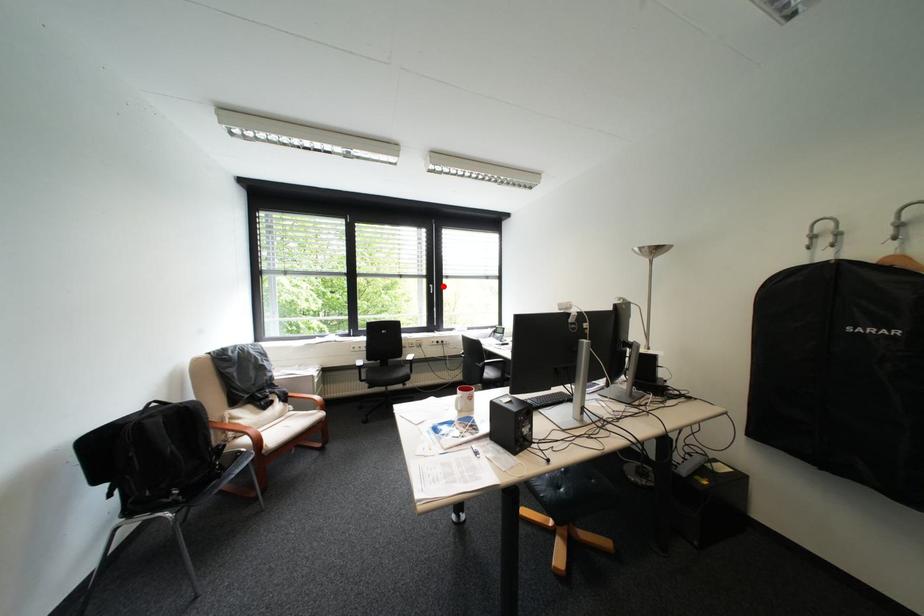
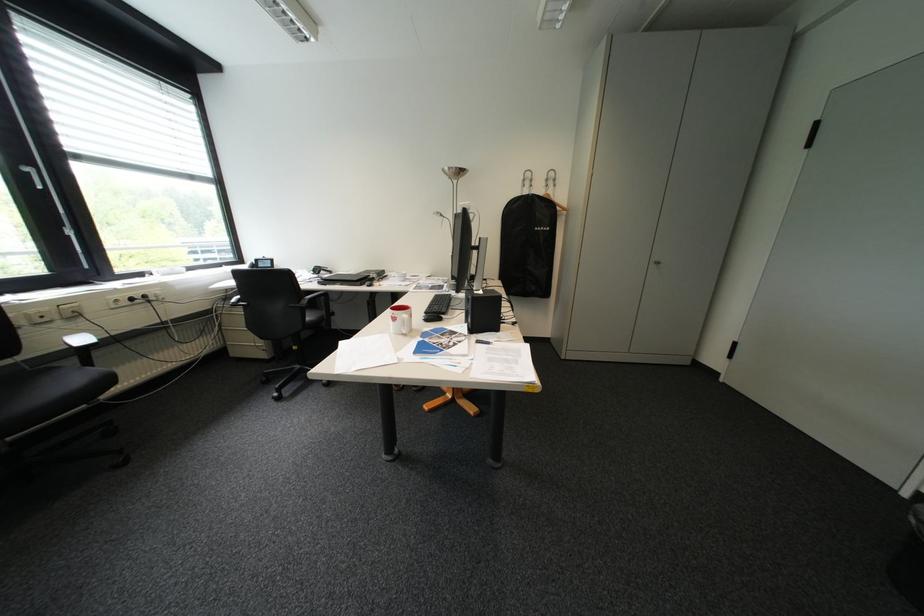
Where in the second image is the point corresponding to the highlighted location from the first image?

(41, 169)